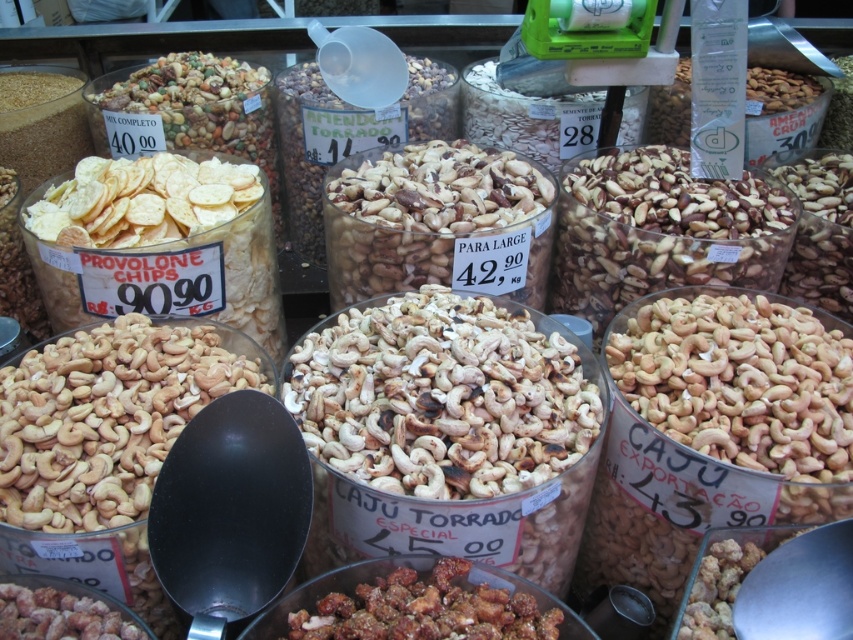
Question: Among these objects, which one is nearest to the camera?

Choices:
 (A) brown matte cashew nuts at lower left
 (B) crispy brown nuts at center

Answer: (B)

Question: Which object is closer to the camera taking this photo?

Choices:
 (A) brown matte cashew nuts at lower left
 (B) crispy brown nuts at center

Answer: (B)

Question: Can you confirm if crispy brown nuts at center is thinner than brown matte cashew nuts at lower left?

Choices:
 (A) no
 (B) yes

Answer: (A)

Question: Which point appears farthest from the camera in this image?

Choices:
 (A) (318, 621)
 (B) (67, 634)

Answer: (A)

Question: Does crispy brown nuts at center appear under brown matte cashew nuts at lower left?

Choices:
 (A) yes
 (B) no

Answer: (B)

Question: Can you confirm if crispy brown nuts at center is positioned below brown matte cashew nuts at lower left?

Choices:
 (A) yes
 (B) no

Answer: (B)